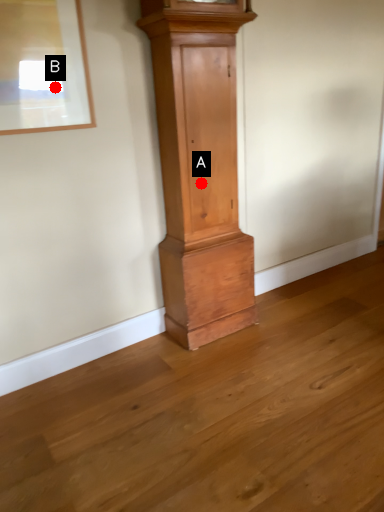
Question: Two points are circled on the image, labeled by A and B beside each circle. Among these points, which one is nearest to the camera?

Choices:
 (A) A is closer
 (B) B is closer

Answer: (B)